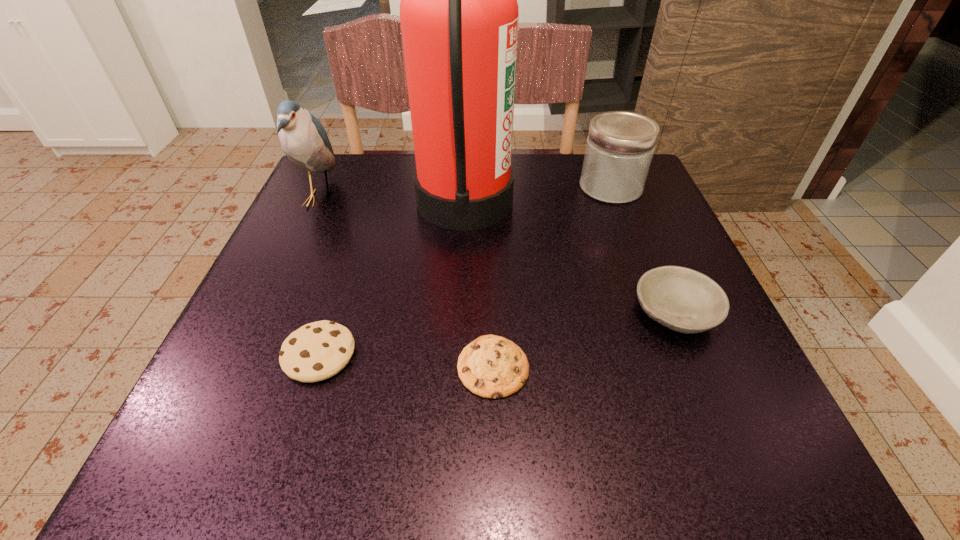
Find the location of a particular element. Image resolution: width=960 pixels, height=540 pixels. free location that satisfies the following two spatial constraints: 1. at the nozzle of the tallest object; 2. on the front side of the taller cookie is located at coordinates (458, 354).

Identify the location of free location that satisfies the following two spatial constraints: 1. at the nozzle of the fire extinguisher; 2. on the right side of the bowl. (460, 312).

This screenshot has width=960, height=540. I want to click on free space that satisfies the following two spatial constraints: 1. at the tip of the leftmost object's beak; 2. on the right side of the bowl, so click(x=266, y=312).

Where is `free point that satisfies the following two spatial constraints: 1. at the tip of the shorter cookie's beak; 2. on the left side of the second tallest object`? The height and width of the screenshot is (540, 960). free point that satisfies the following two spatial constraints: 1. at the tip of the shorter cookie's beak; 2. on the left side of the second tallest object is located at coordinates (241, 367).

Where is `free location that satisfies the following two spatial constraints: 1. at the tip of the second object from left to right's beak; 2. on the left side of the bird`? free location that satisfies the following two spatial constraints: 1. at the tip of the second object from left to right's beak; 2. on the left side of the bird is located at coordinates (247, 354).

What are the coordinates of `blank space that satisfies the following two spatial constraints: 1. at the tip of the second tallest object's beak; 2. on the back side of the shorter cookie` in the screenshot? It's located at (241, 367).

You are a GUI agent. You are given a task and a screenshot of the screen. Output one action in this format:
    pyautogui.click(x=<x>, y=<y>)
    Task: Click on the vacant space that satisfies the following two spatial constraints: 1. at the nozzle of the shorter cookie; 2. on the left side of the tallest object
    
    Given the screenshot: What is the action you would take?
    pyautogui.click(x=458, y=367)

Where is `free location that satisfies the following two spatial constraints: 1. at the tip of the second tallest object's beak; 2. on the left side of the second object from left to right`? The width and height of the screenshot is (960, 540). free location that satisfies the following two spatial constraints: 1. at the tip of the second tallest object's beak; 2. on the left side of the second object from left to right is located at coordinates (247, 354).